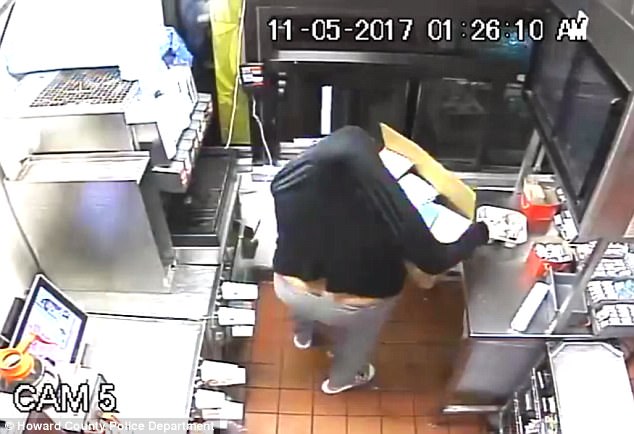
Image resolution: width=634 pixels, height=434 pixels. I want to click on cups, so [231, 409], [203, 396], [220, 369], [241, 378], [250, 329], [243, 317], [243, 287].